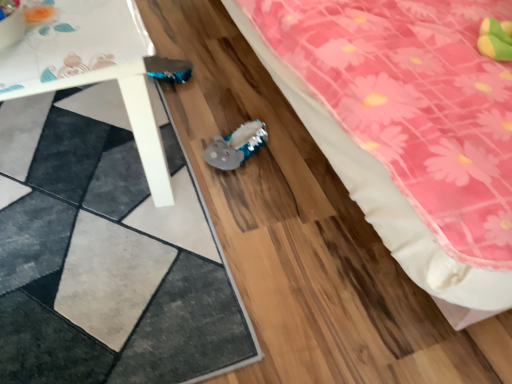
Identify the location of free location to the right of textured gray rug at lower left. The width and height of the screenshot is (512, 384). (290, 233).